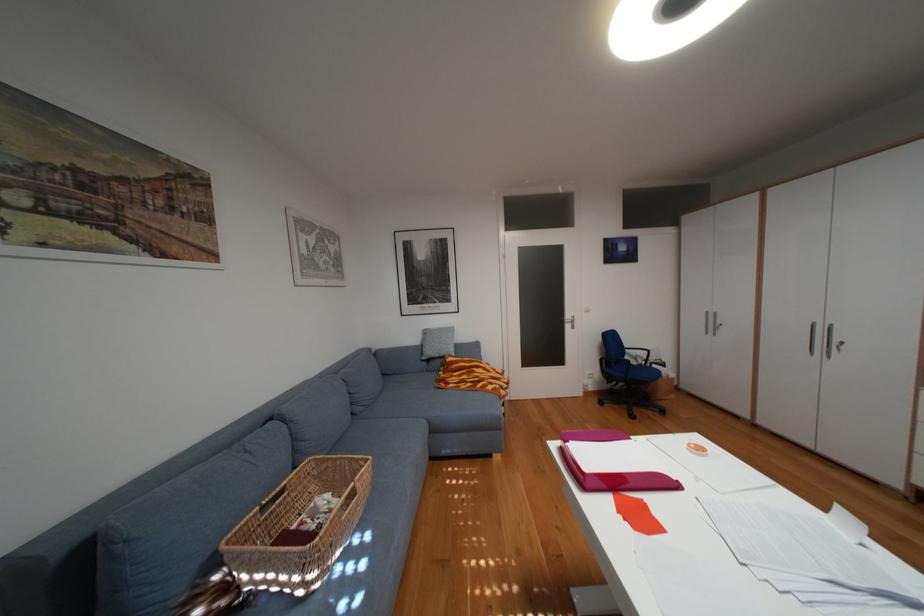
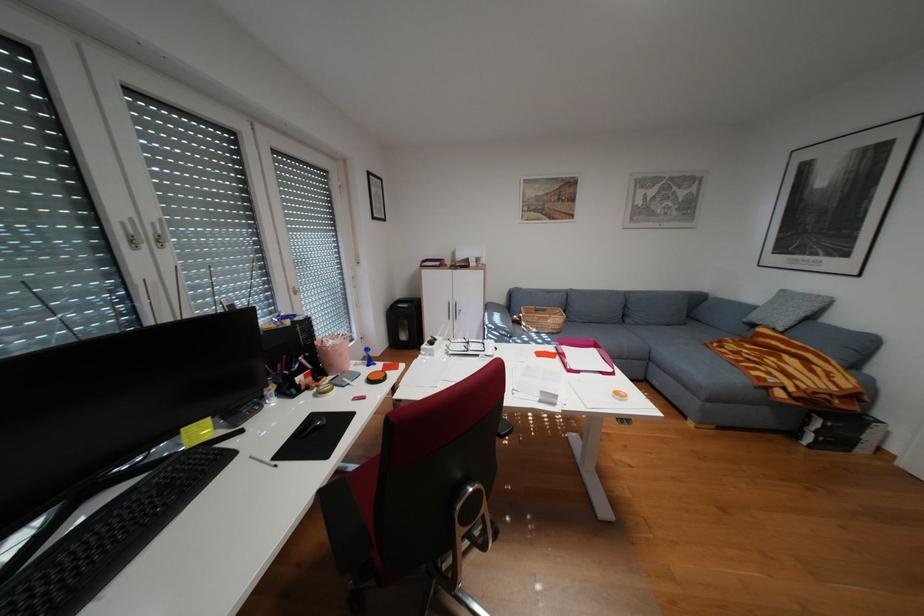
Locate, in the second image, the point that corresponds to (x=504, y=383) in the first image.

(782, 373)